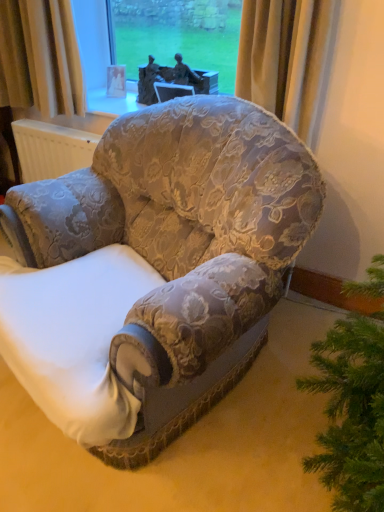
Describe the element at coordinates (160, 268) in the screenshot. I see `floral fabric armchair at center` at that location.

Identify the location of floral fabric armchair at center. The width and height of the screenshot is (384, 512). (160, 268).

The width and height of the screenshot is (384, 512). Describe the element at coordinates (178, 35) in the screenshot. I see `bronze statue at upper center` at that location.

The height and width of the screenshot is (512, 384). I want to click on bronze statue at upper center, so click(x=178, y=35).

Where is `floral fabric armchair at center`? floral fabric armchair at center is located at coordinates (160, 268).

Considering the positions of objects bronze statue at upper center and floral fabric armchair at center in the image provided, who is more to the left, bronze statue at upper center or floral fabric armchair at center?

floral fabric armchair at center is more to the left.

Is bronze statue at upper center positioned behind floral fabric armchair at center?

That is True.

Is point (189, 50) farther from viewer compared to point (193, 257)?

Yes, it is behind point (193, 257).

From the image's perspective, is bronze statue at upper center under floral fabric armchair at center?

Actually, bronze statue at upper center appears above floral fabric armchair at center in the image.

From a real-world perspective, is bronze statue at upper center physically below floral fabric armchair at center?

No, from a real-world perspective, bronze statue at upper center is not beneath floral fabric armchair at center.

In terms of width, does bronze statue at upper center look wider or thinner when compared to floral fabric armchair at center?

Considering their sizes, bronze statue at upper center looks slimmer than floral fabric armchair at center.

Which of these two, bronze statue at upper center or floral fabric armchair at center, stands taller?

Standing taller between the two is floral fabric armchair at center.

Considering the relative sizes of bronze statue at upper center and floral fabric armchair at center in the image provided, is bronze statue at upper center bigger than floral fabric armchair at center?

No, bronze statue at upper center is not bigger than floral fabric armchair at center.

Does bronze statue at upper center contain floral fabric armchair at center?

No.

Is bronze statue at upper center with floral fabric armchair at center?

No, bronze statue at upper center is not in contact with floral fabric armchair at center.

Is floral fabric armchair at center at the back of bronze statue at upper center?

No, floral fabric armchair at center is not at the back of bronze statue at upper center.

How many degrees apart are the facing directions of bronze statue at upper center and floral fabric armchair at center?

20 degrees separate the facing orientations of bronze statue at upper center and floral fabric armchair at center.

Find the location of a particular element. Image resolution: width=384 pixels, height=512 pixels. chair in front of the bronze statue at upper center is located at coordinates (160, 268).

Based on the photo, which is more to the left, floral fabric armchair at center or bronze statue at upper center?

floral fabric armchair at center is more to the left.

Looking at this image, considering the positions of objects floral fabric armchair at center and bronze statue at upper center in the image provided, who is behind, floral fabric armchair at center or bronze statue at upper center?

Positioned behind is bronze statue at upper center.

Considering the points (169, 408) and (204, 20), which point is in front, point (169, 408) or point (204, 20)?

Point (169, 408)

From the image's perspective, is floral fabric armchair at center over bronze statue at upper center?

No.

From a real-world perspective, between floral fabric armchair at center and bronze statue at upper center, who is vertically higher?

From a 3D spatial view, bronze statue at upper center is above.

Between floral fabric armchair at center and bronze statue at upper center, which one has smaller width?

With smaller width is bronze statue at upper center.

Considering the sizes of objects floral fabric armchair at center and bronze statue at upper center in the image provided, who is taller, floral fabric armchair at center or bronze statue at upper center?

With more height is floral fabric armchair at center.

Looking at the image, does floral fabric armchair at center seem bigger or smaller compared to bronze statue at upper center?

Clearly, floral fabric armchair at center is larger in size than bronze statue at upper center.

Consider the image. Would you say bronze statue at upper center is part of floral fabric armchair at center's contents?

No, bronze statue at upper center is not a part of floral fabric armchair at center.

Is there a large distance between floral fabric armchair at center and bronze statue at upper center?

That's right, there is a large distance between floral fabric armchair at center and bronze statue at upper center.

Is floral fabric armchair at center positioned with its back to bronze statue at upper center?

No, floral fabric armchair at center is not facing the opposite direction of bronze statue at upper center.

How different are the orientations of floral fabric armchair at center and bronze statue at upper center in degrees?

The angular difference between floral fabric armchair at center and bronze statue at upper center is 20 degrees.

The width and height of the screenshot is (384, 512). I want to click on chair below the bronze statue at upper center (from the image's perspective), so click(x=160, y=268).

At what (x,y) coordinates should I click in order to perform the action: click on window screen located on the right of floral fabric armchair at center. Please return your answer as a coordinate pair (x, y). Looking at the image, I should click on (178, 35).

Find the location of `chair lying on the left of bronze statue at upper center`. chair lying on the left of bronze statue at upper center is located at coordinates (160, 268).